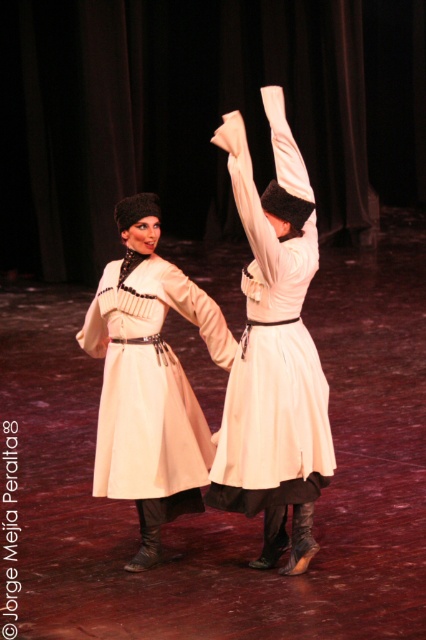
Question: Is white satin dress at center positioned at the back of matte white coat at center?

Choices:
 (A) yes
 (B) no

Answer: (B)

Question: Which object is the farthest from the matte white coat at upper center?

Choices:
 (A) white satin dress at center
 (B) matte white dress at center

Answer: (A)

Question: Does matte white dress at center lie behind matte white coat at center?

Choices:
 (A) no
 (B) yes

Answer: (A)

Question: Is matte white coat at center above matte white coat at upper center?

Choices:
 (A) yes
 (B) no

Answer: (B)

Question: Which of the following is the farthest from the observer?

Choices:
 (A) matte white coat at upper center
 (B) matte white coat at center

Answer: (A)

Question: Based on their relative distances, which object is farther from the matte white coat at upper center?

Choices:
 (A) matte white coat at center
 (B) matte white dress at center
 (C) white satin dress at center

Answer: (C)